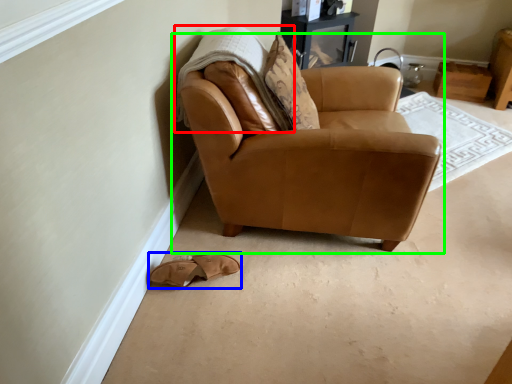
Question: Estimate the real-world distances between objects in this image. Which object is closer to blanket (highlighted by a red box), footwear (highlighted by a blue box) or chair (highlighted by a green box)?

Choices:
 (A) footwear
 (B) chair

Answer: (B)